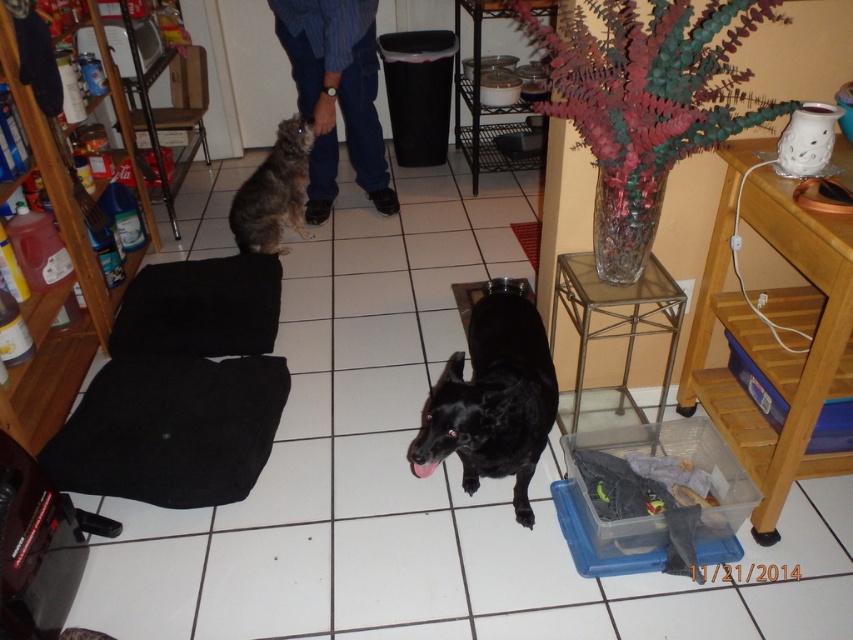
Question: Does black matte dog at center appear over gold metallic stool at center?

Choices:
 (A) no
 (B) yes

Answer: (A)

Question: Among these objects, which one is farthest from the camera?

Choices:
 (A) fuzzy brown cat at upper left
 (B) blue denim jeans at center
 (C) black matte dog at center
 (D) gold metallic stool at center

Answer: (A)

Question: Does blue denim jeans at center have a lesser width compared to fuzzy brown cat at upper left?

Choices:
 (A) yes
 (B) no

Answer: (B)

Question: Which point is farther from the camera taking this photo?

Choices:
 (A) (641, 285)
 (B) (357, 81)
 (C) (553, 410)
 (D) (281, 145)

Answer: (B)

Question: Which object appears closest to the camera in this image?

Choices:
 (A) fuzzy brown cat at upper left
 (B) black matte dog at center

Answer: (B)

Question: Is black matte dog at center below fuzzy brown cat at upper left?

Choices:
 (A) yes
 (B) no

Answer: (A)